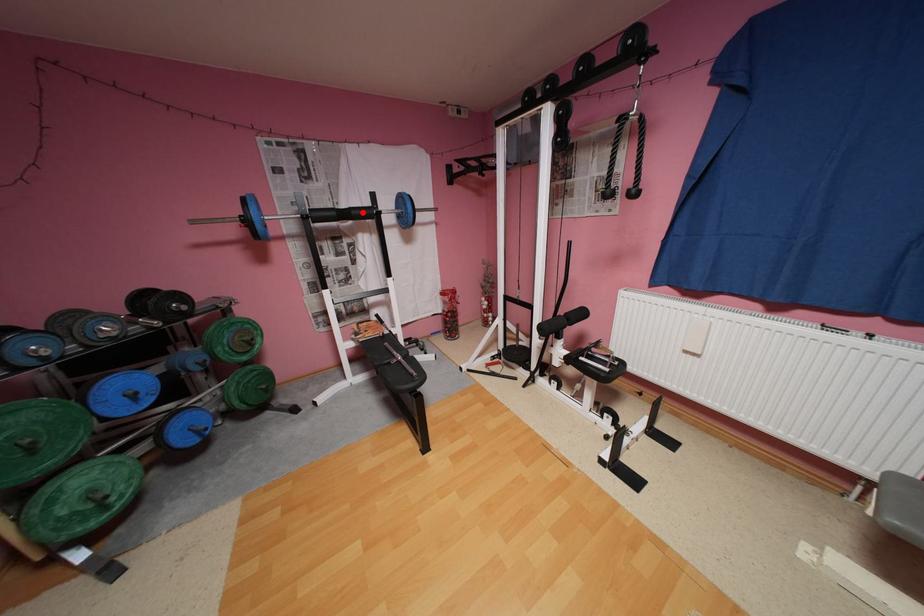
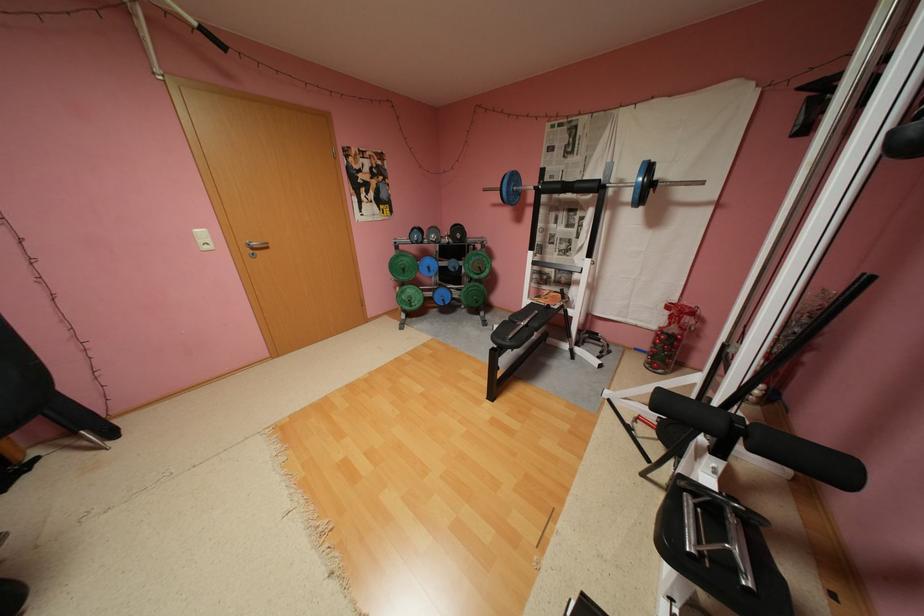
In the second image, find the point that corresponds to the highlighted location in the first image.

(586, 185)